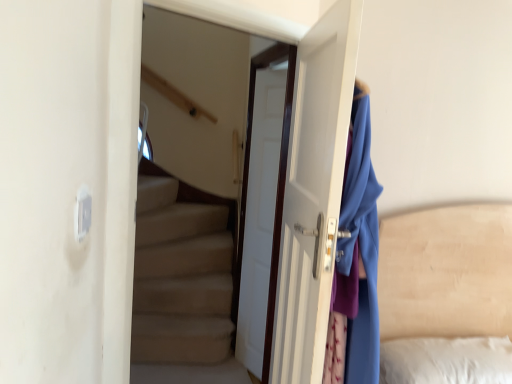
What do you see at coordinates (313, 192) in the screenshot? I see `white glossy door at center, the second door positioned from the back` at bounding box center [313, 192].

Find the location of a particular element. white glossy door at center, the second door positioned from the back is located at coordinates (313, 192).

What do you see at coordinates (262, 209) in the screenshot? The width and height of the screenshot is (512, 384). I see `white glossy door at center, acting as the second door starting from the front` at bounding box center [262, 209].

At what (x,y) coordinates should I click in order to perform the action: click on white glossy door at center, acting as the second door starting from the front. Please return your answer as a coordinate pair (x, y). Looking at the image, I should click on (262, 209).

Where is `white glossy door at center, placed as the first door when sorted from front to back`? white glossy door at center, placed as the first door when sorted from front to back is located at coordinates (313, 192).

Considering the positions of objects white glossy door at center, acting as the second door starting from the front, and white glossy door at center, placed as the first door when sorted from front to back, in the image provided, who is more to the left, white glossy door at center, acting as the second door starting from the front, or white glossy door at center, placed as the first door when sorted from front to back,?

From the viewer's perspective, white glossy door at center, acting as the second door starting from the front, appears more on the left side.

Is the depth of white glossy door at center, which is counted as the 1th door, starting from the back, greater than that of white glossy door at center, the second door positioned from the back?

Yes, white glossy door at center, which is counted as the 1th door, starting from the back, is behind white glossy door at center, the second door positioned from the back.

Does point (250, 327) appear closer or farther from the camera than point (321, 145)?

Point (250, 327) is farther from the camera than point (321, 145).

From the image's perspective, which object appears higher, white glossy door at center, acting as the second door starting from the front, or white glossy door at center, the second door positioned from the back?

white glossy door at center, acting as the second door starting from the front, from the image's perspective.

From a real-world perspective, is white glossy door at center, which is counted as the 1th door, starting from the back, positioned over white glossy door at center, the second door positioned from the back, based on gravity?

No, from a real-world perspective, white glossy door at center, which is counted as the 1th door, starting from the back, is not over white glossy door at center, the second door positioned from the back

Between white glossy door at center, acting as the second door starting from the front, and white glossy door at center, placed as the first door when sorted from front to back, which one has smaller width?

white glossy door at center, acting as the second door starting from the front, is thinner.

Considering the sizes of white glossy door at center, acting as the second door starting from the front, and white glossy door at center, placed as the first door when sorted from front to back, in the image, is white glossy door at center, acting as the second door starting from the front, taller or shorter than white glossy door at center, placed as the first door when sorted from front to back,?

Considering their sizes, white glossy door at center, acting as the second door starting from the front, has more height than white glossy door at center, placed as the first door when sorted from front to back.

Which of these two, white glossy door at center, acting as the second door starting from the front, or white glossy door at center, placed as the first door when sorted from front to back, is smaller?

Smaller between the two is white glossy door at center, placed as the first door when sorted from front to back.

Would you say white glossy door at center, which is counted as the 1th door, starting from the back, is outside white glossy door at center, the second door positioned from the back?

Yes, white glossy door at center, which is counted as the 1th door, starting from the back, is located beyond the bounds of white glossy door at center, the second door positioned from the back.

Is white glossy door at center, acting as the second door starting from the front, far away from white glossy door at center, the second door positioned from the back?

They are positioned close to each other.

Is white glossy door at center, which is counted as the 1th door, starting from the back, aimed at white glossy door at center, the second door positioned from the back?

No.

Could you measure the distance between white glossy door at center, which is counted as the 1th door, starting from the back, and white glossy door at center, the second door positioned from the back?

white glossy door at center, which is counted as the 1th door, starting from the back, and white glossy door at center, the second door positioned from the back, are 19.81 inches apart.

The image size is (512, 384). I want to click on door above the white glossy door at center, acting as the second door starting from the front (from a real-world perspective), so click(313, 192).

Can you confirm if white glossy door at center, the second door positioned from the back, is positioned to the left of white glossy door at center, which is counted as the 1th door, starting from the back?

No.

Is white glossy door at center, the second door positioned from the back, further to camera compared to white glossy door at center, which is counted as the 1th door, starting from the back?

No, it is in front of white glossy door at center, which is counted as the 1th door, starting from the back.

Is point (272, 338) positioned in front of point (286, 70)?

Yes, it is.

From the image's perspective, which is below, white glossy door at center, placed as the first door when sorted from front to back, or white glossy door at center, which is counted as the 1th door, starting from the back?

white glossy door at center, placed as the first door when sorted from front to back, from the image's perspective.

From a real-world perspective, relative to white glossy door at center, acting as the second door starting from the front, is white glossy door at center, placed as the first door when sorted from front to back, vertically above or below?

From a real-world perspective, white glossy door at center, placed as the first door when sorted from front to back, is physically above white glossy door at center, acting as the second door starting from the front.

Is white glossy door at center, the second door positioned from the back, wider than white glossy door at center, acting as the second door starting from the front?

Yes, white glossy door at center, the second door positioned from the back, is wider than white glossy door at center, acting as the second door starting from the front.

Looking at this image, is white glossy door at center, the second door positioned from the back, taller or shorter than white glossy door at center, acting as the second door starting from the front?

In the image, white glossy door at center, the second door positioned from the back, appears to be shorter than white glossy door at center, acting as the second door starting from the front.

Who is smaller, white glossy door at center, placed as the first door when sorted from front to back, or white glossy door at center, which is counted as the 1th door, starting from the back?

white glossy door at center, placed as the first door when sorted from front to back.

Is white glossy door at center, the second door positioned from the back, outside of white glossy door at center, acting as the second door starting from the front?

white glossy door at center, the second door positioned from the back, lies outside white glossy door at center, acting as the second door starting from the front,'s area.

Is there a large distance between white glossy door at center, the second door positioned from the back, and white glossy door at center, acting as the second door starting from the front?

Actually, white glossy door at center, the second door positioned from the back, and white glossy door at center, acting as the second door starting from the front, are a little close together.

Is white glossy door at center, placed as the first door when sorted from front to back, looking in the opposite direction of white glossy door at center, which is counted as the 1th door, starting from the back?

That's not correct — white glossy door at center, placed as the first door when sorted from front to back, is not looking away from white glossy door at center, which is counted as the 1th door, starting from the back.

Image resolution: width=512 pixels, height=384 pixels. I want to click on door behind the white glossy door at center, the second door positioned from the back, so click(x=262, y=209).

Where is `door on the right side of white glossy door at center, which is counted as the 1th door, starting from the back`? door on the right side of white glossy door at center, which is counted as the 1th door, starting from the back is located at coordinates (313, 192).

This screenshot has width=512, height=384. Identify the location of door located below the white glossy door at center, acting as the second door starting from the front (from the image's perspective). (313, 192).